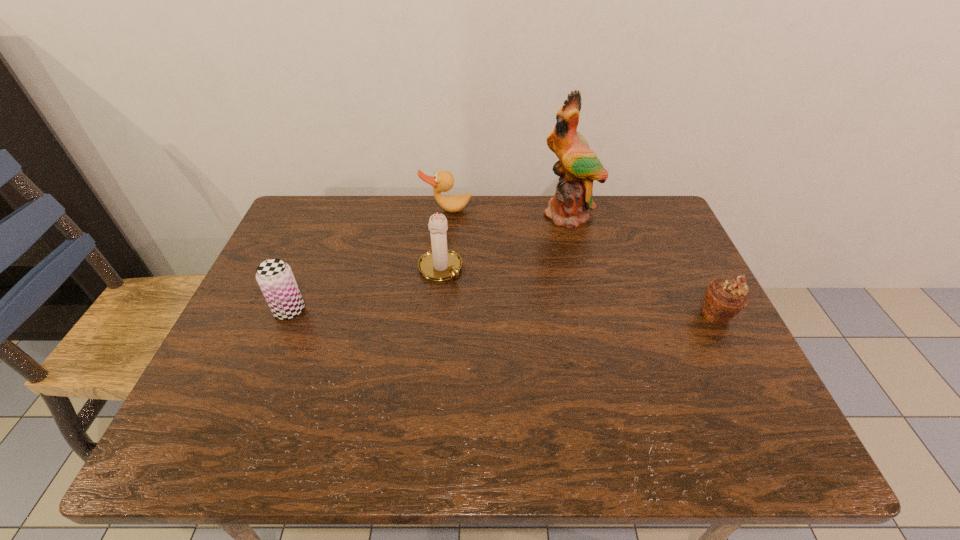
You are a GUI agent. You are given a task and a screenshot of the screen. Output one action in this format:
    pyautogui.click(x=<x>, y=<y>)
    Task: Click on the vacant space located 0.310m on the front-facing side of the second object from right to left
    The image size is (960, 540).
    Given the screenshot: What is the action you would take?
    pyautogui.click(x=546, y=301)

I want to click on free point located 0.050m on the front-facing side of the second object from right to left, so click(x=563, y=239).

The height and width of the screenshot is (540, 960). What are the coordinates of `blank area located on the beak of the duck` in the screenshot? It's located at (448, 231).

At what (x,y) coordinates should I click in order to perform the action: click on vacant space situated on the beak of the duck. Please return your answer as a coordinate pair (x, y). The width and height of the screenshot is (960, 540). Looking at the image, I should click on pyautogui.click(x=449, y=292).

In order to click on vacant area situated on the beak of the duck in this screenshot , I will do `click(449, 264)`.

This screenshot has width=960, height=540. Identify the location of free space located on the handle side of the third farthest object. (478, 306).

This screenshot has width=960, height=540. What are the coordinates of `blank space located on the handle side of the third farthest object` in the screenshot? It's located at point(478,306).

Image resolution: width=960 pixels, height=540 pixels. What are the coordinates of `free space located on the handle side of the third farthest object` in the screenshot? It's located at (476, 303).

What are the coordinates of `parrot located at the far edge` in the screenshot? It's located at (578, 166).

Image resolution: width=960 pixels, height=540 pixels. I want to click on duck located in the far edge section of the desktop, so click(443, 181).